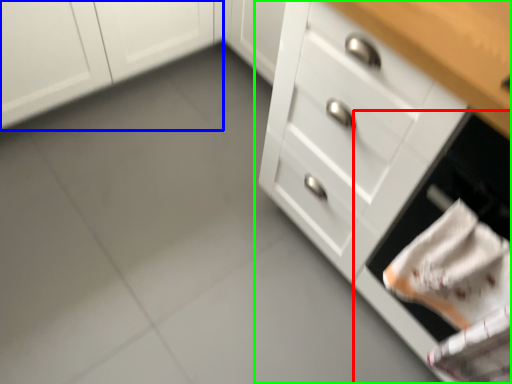
Question: Based on their relative distances, which object is farther from oven (highlighted by a red box)? Choose from cabinetry (highlighted by a blue box) and chest of drawers (highlighted by a green box).

Choices:
 (A) cabinetry
 (B) chest of drawers

Answer: (A)